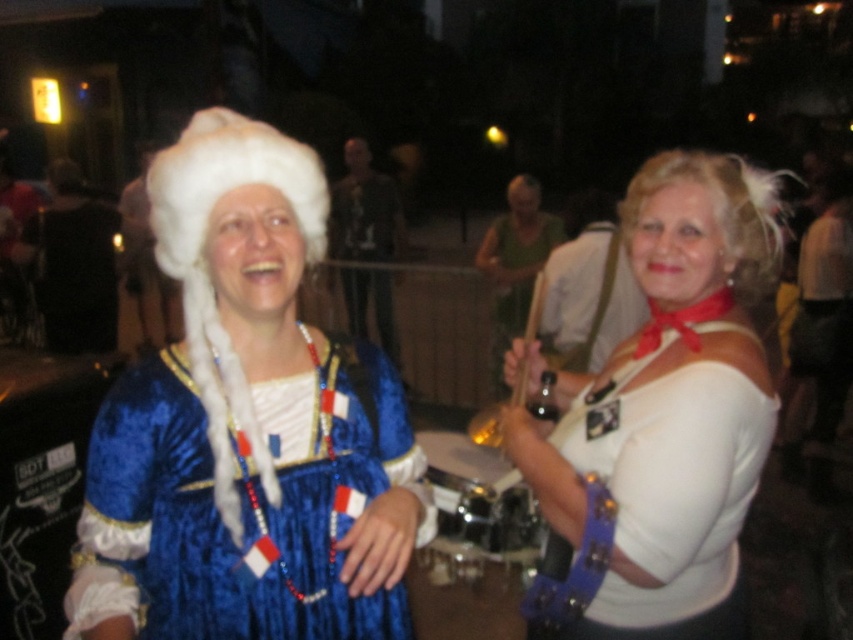
Question: Can you confirm if velvet blue dress at center is thinner than white feathered wig at upper right?

Choices:
 (A) no
 (B) yes

Answer: (B)

Question: Is velvet blue dress at center to the left of white feathered wig at upper right from the viewer's perspective?

Choices:
 (A) no
 (B) yes

Answer: (B)

Question: Is velvet blue dress at center closer to the viewer compared to white matte shirt at center?

Choices:
 (A) yes
 (B) no

Answer: (A)

Question: Which object is farther from the camera taking this photo?

Choices:
 (A) white feathered wig at upper right
 (B) velvet blue dress at center
 (C) white matte shirt at center
 (D) white fluffy wig at upper left

Answer: (A)

Question: Estimate the real-world distances between objects in this image. Which object is farther from the white matte shirt at center?

Choices:
 (A) white fluffy wig at upper left
 (B) white feathered wig at upper right

Answer: (B)

Question: Considering the real-world distances, which object is farthest from the velvet blue dress at center?

Choices:
 (A) white fluffy wig at upper left
 (B) white matte shirt at center

Answer: (B)